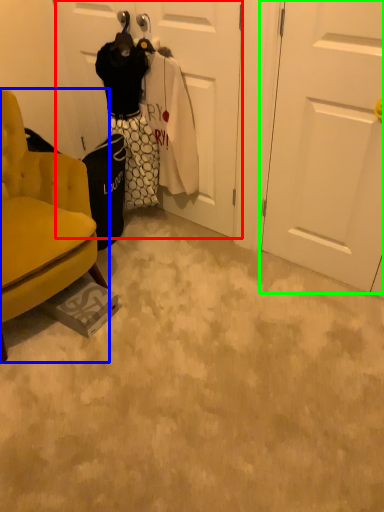
Question: Based on their relative distances, which object is farther from door (highlighted by a red box)? Choose from chair (highlighted by a blue box) and door (highlighted by a green box).

Choices:
 (A) chair
 (B) door

Answer: (A)